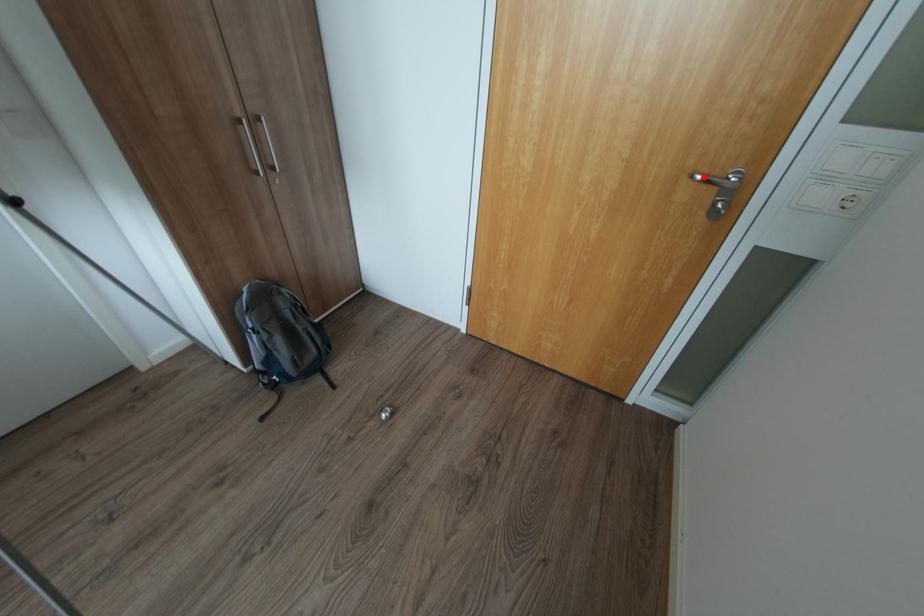
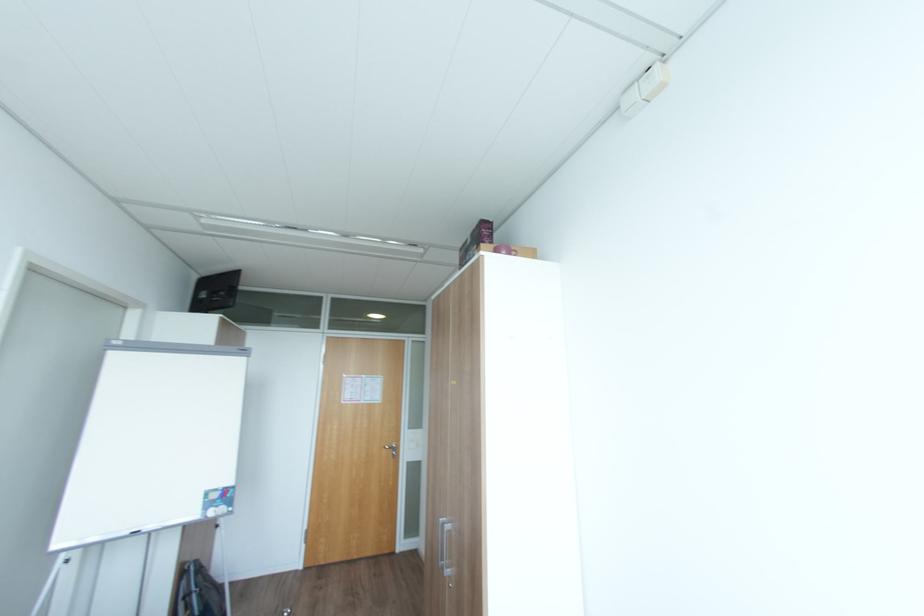
Question: I am providing you with two images of the same scene from different viewpoints. A red point is shown in image1. For the corresponding object point in image2, is it positioned nearer or farther from the camera?

Choices:
 (A) Nearer
 (B) Farther

Answer: (B)